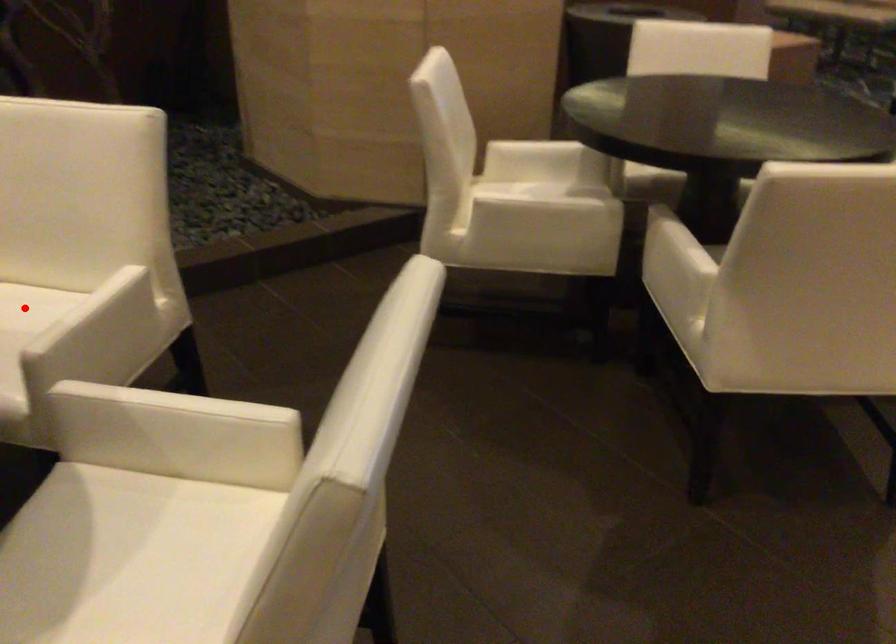
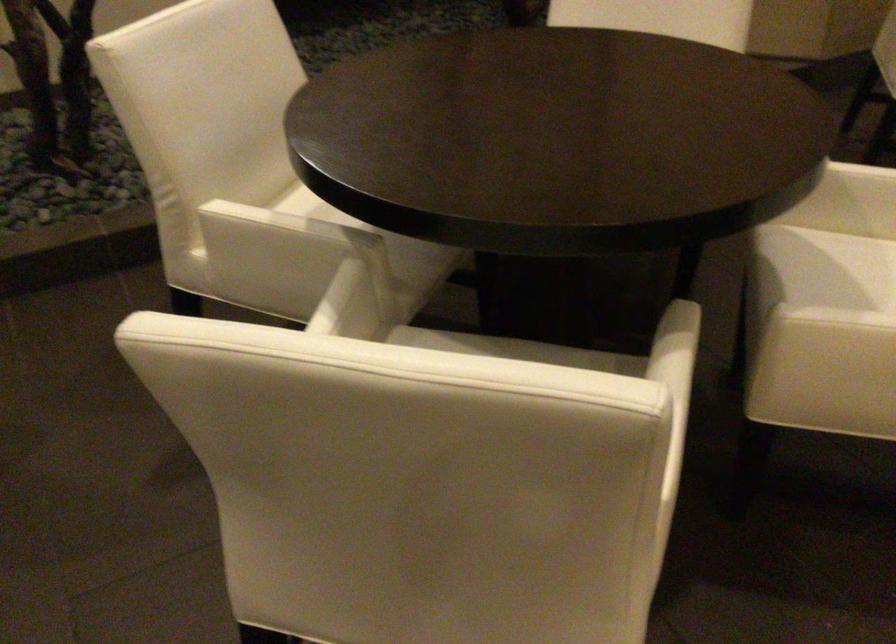
Question: I am providing you with two images of the same scene from different viewpoints. A red point is marked on the first image. At the location where the point appears in image 1, is it still visible in image 2?

Choices:
 (A) Yes
 (B) No

Answer: (B)